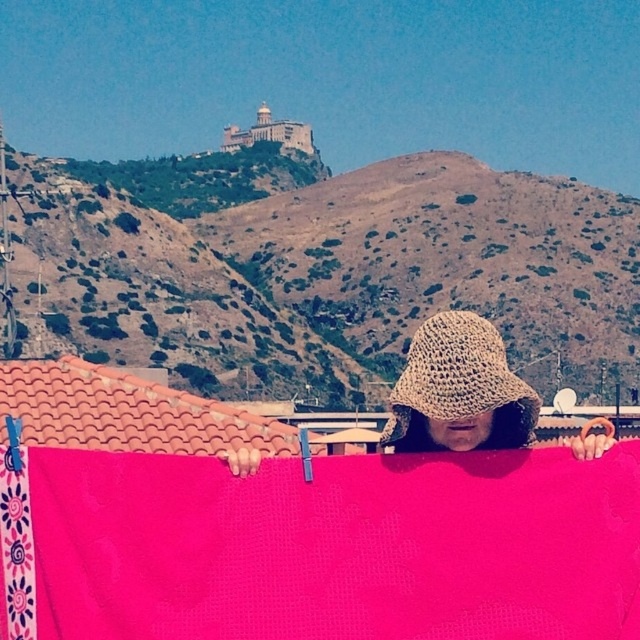
Who is shorter, pink woven cloth at center or crochet hat at center?

crochet hat at center

Between pink woven cloth at center and crochet hat at center, which one has more height?

pink woven cloth at center

In the scene shown: Who is more forward, (378, 611) or (416, 349)?

Positioned in front is point (378, 611).

At what (x,y) coordinates should I click in order to perform the action: click on pink woven cloth at center. Please return your answer as a coordinate pair (x, y). The height and width of the screenshot is (640, 640). Looking at the image, I should click on (328, 547).